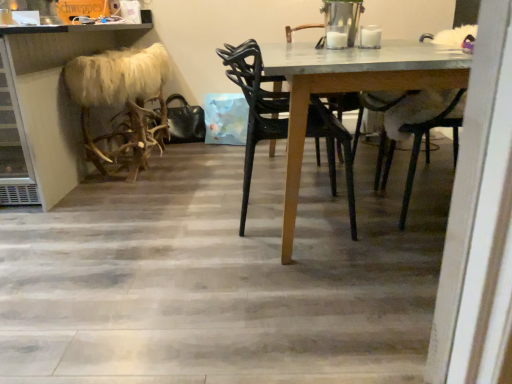
This screenshot has width=512, height=384. I want to click on wooden table at center, so click(x=350, y=89).

The height and width of the screenshot is (384, 512). Find the location of `black plastic chair at center`. black plastic chair at center is located at coordinates pyautogui.click(x=254, y=106).

The width and height of the screenshot is (512, 384). What are the coordinates of `wooden table at center` in the screenshot? It's located at (350, 89).

At what (x,y) coordinates should I click in order to perform the action: click on table above the furry white antlers at left (from a real-world perspective). Please return your answer as a coordinate pair (x, y). This screenshot has width=512, height=384. Looking at the image, I should click on (350, 89).

Is furry white antlers at left far from wooden table at center?

Absolutely, furry white antlers at left is distant from wooden table at center.

Is furry white antlers at left oriented away from wooden table at center?

Yes, furry white antlers at left's orientation is away from wooden table at center.

From a real-world perspective, is furry white antlers at left located beneath wooden table at center?

Yes, from a real-world perspective, furry white antlers at left is beneath wooden table at center.

Could you tell me if faux fur stool at left is facing furry white antlers at left?

No, faux fur stool at left is not facing towards furry white antlers at left.

Is faux fur stool at left positioned in front of furry white antlers at left?

Yes, it is.

Between faux fur stool at left and furry white antlers at left, which one has more height?

With more height is faux fur stool at left.

Does faux fur stool at left have a lesser width compared to furry white antlers at left?

In fact, faux fur stool at left might be wider than furry white antlers at left.

Can you tell me how much faux fur stool at left and white fur at upper right differ in facing direction?

faux fur stool at left and white fur at upper right are facing 137 degrees away from each other.

Which of these two, faux fur stool at left or white fur at upper right, stands taller?

With more height is faux fur stool at left.

The image size is (512, 384). What are the coordinates of `screen door lying in front of the faux fur stool at left` in the screenshot? It's located at (479, 217).

In terms of height, does furry white antlers at left look taller or shorter compared to black plastic chair at center?

furry white antlers at left is shorter than black plastic chair at center.

Which is behind, point (72, 79) or point (238, 50)?

Positioned behind is point (72, 79).

From the picture: From the image's perspective, is furry white antlers at left above or below black plastic chair at center?

Based on their image positions, furry white antlers at left is located above black plastic chair at center.

From the image's perspective, which one is positioned higher, wooden table at center or furry white antlers at left?

furry white antlers at left.

Which object is closer to the camera, wooden table at center or furry white antlers at left?

Positioned in front is wooden table at center.

Would you say wooden table at center is a long distance from furry white antlers at left?

wooden table at center is far away from furry white antlers at left.

Which of these two, wooden table at center or furry white antlers at left, stands shorter?

furry white antlers at left.

Is furry white antlers at left next to white fur at upper right?

No, furry white antlers at left is not next to white fur at upper right.

Considering the sizes of furry white antlers at left and white fur at upper right in the image, is furry white antlers at left taller or shorter than white fur at upper right?

In the image, furry white antlers at left appears to be shorter than white fur at upper right.

Looking at this image, which object is further away from the camera taking this photo, furry white antlers at left or white fur at upper right?

Positioned behind is furry white antlers at left.

Considering the positions of points (443, 57) and (352, 213), is point (443, 57) closer to camera compared to point (352, 213)?

That is True.

From the image's perspective, between wooden table at center and black plastic chair at center, who is located below?

black plastic chair at center.

Is wooden table at center taller than black plastic chair at center?

No, wooden table at center is not taller than black plastic chair at center.

Is wooden table at center facing away from black plastic chair at center?

Yes, black plastic chair at center is at the back of wooden table at center.

In the image, there is a furry white antlers at left. What are the coordinates of `table below it (from the image's perspective)` in the screenshot? It's located at (350, 89).

Where is `counter in front of the furry white antlers at left`? The height and width of the screenshot is (384, 512). counter in front of the furry white antlers at left is located at coordinates (46, 107).

Considering their positions, is wooden table at center positioned further to white fur at upper right than furry white antlers at left?

The object further to white fur at upper right is furry white antlers at left.

From the image, which object appears to be nearer to faux fur stool at left, white fur at upper right or wooden table at center?

wooden table at center is positioned closer to the anchor faux fur stool at left.

Based on their spatial positions, is wooden table at center or white fur at upper right closer to furry white antlers at left?

wooden table at center lies closer to furry white antlers at left than the other object.

When comparing their distances from faux fur stool at left, does black plastic chair at center or wooden table at center seem further?

wooden table at center is further to faux fur stool at left.

Estimate the real-world distances between objects in this image. Which object is closer to black plastic chair at center, white fur at upper right or wooden table at center?

wooden table at center is closer to black plastic chair at center.

Which object lies nearer to the anchor point wooden table at center, black plastic chair at center or furry white antlers at left?

Among the two, black plastic chair at center is located nearer to wooden table at center.

Looking at the image, which one is located closer to wooden table at center, furry white antlers at left or faux fur stool at left?

Among the two, furry white antlers at left is located nearer to wooden table at center.

Consider the image. Looking at the image, which one is located further to black plastic chair at center, furry white antlers at left or faux fur stool at left?

faux fur stool at left is further to black plastic chair at center.

Where is `animal situated between faux fur stool at left and wooden table at center from left to right`? animal situated between faux fur stool at left and wooden table at center from left to right is located at coordinates coord(122,97).

The height and width of the screenshot is (384, 512). Identify the location of table between white fur at upper right and black plastic chair at center from front to back. (350, 89).

You are a GUI agent. You are given a task and a screenshot of the screen. Output one action in this format:
    pyautogui.click(x=<x>, y=<y>)
    Task: Click on the animal situated between faux fur stool at left and black plastic chair at center from left to right
    The width and height of the screenshot is (512, 384).
    Given the screenshot: What is the action you would take?
    pyautogui.click(x=122, y=97)

The image size is (512, 384). Identify the location of chair between faux fur stool at left and wooden table at center in the horizontal direction. (254, 106).